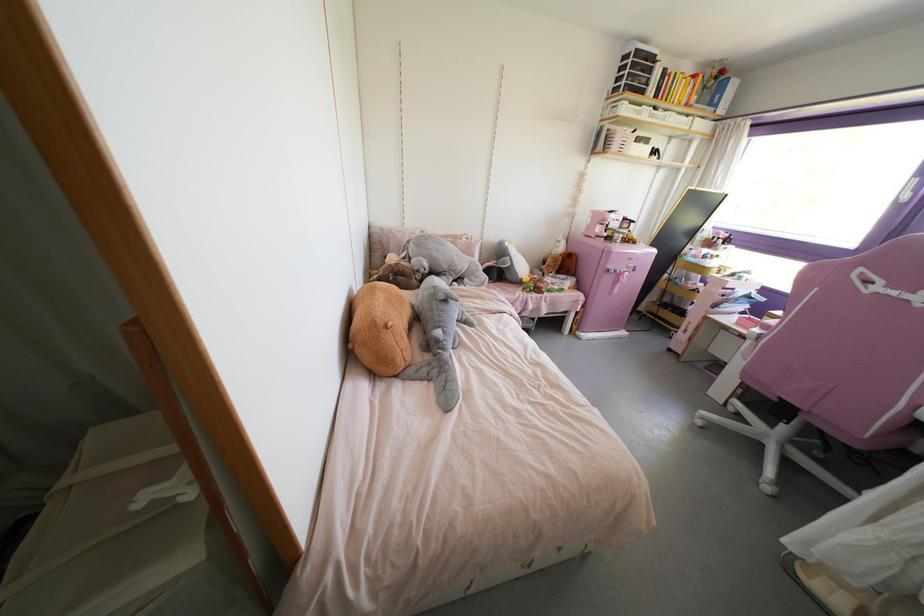
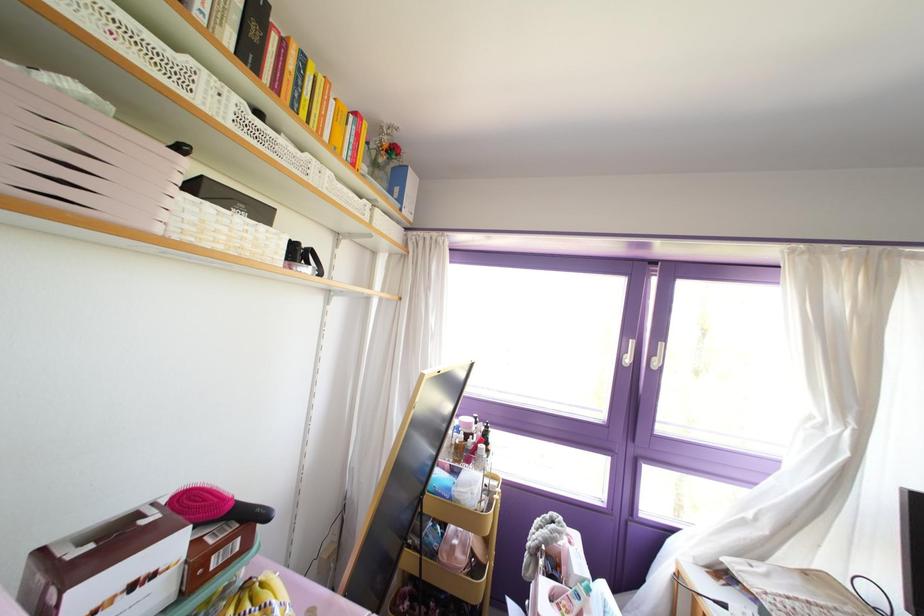
Find the pixel in the second image that matches [639,145] in the first image.

(237, 219)